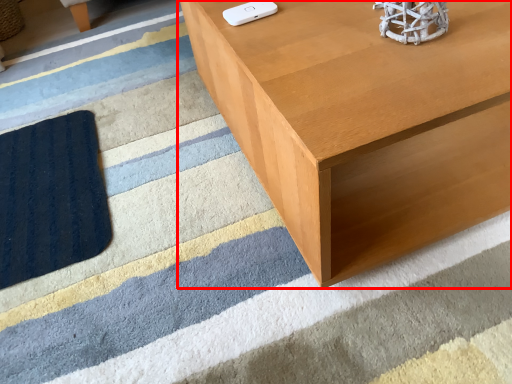
Question: From the image's perspective, where is table (annotated by the red box) located relative to Wii controller?

Choices:
 (A) below
 (B) above

Answer: (B)